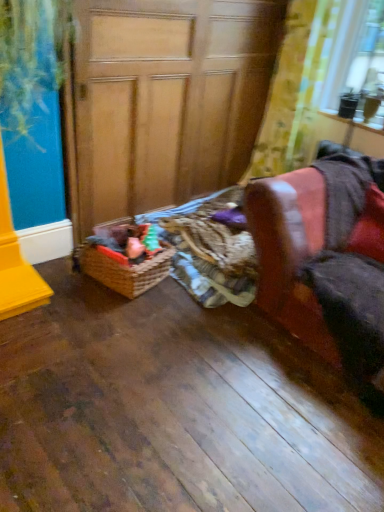
Question: Is the surface of yellow floral fabric at upper right in direct contact with woven brown basket at lower center?

Choices:
 (A) no
 (B) yes

Answer: (A)

Question: Is woven brown basket at lower center inside yellow floral fabric at upper right?

Choices:
 (A) yes
 (B) no

Answer: (B)

Question: Is the depth of yellow floral fabric at upper right greater than that of woven brown basket at lower center?

Choices:
 (A) no
 (B) yes

Answer: (B)

Question: From the image's perspective, is yellow floral fabric at upper right on woven brown basket at lower center?

Choices:
 (A) no
 (B) yes

Answer: (B)

Question: Is yellow floral fabric at upper right to the right of woven brown basket at lower center from the viewer's perspective?

Choices:
 (A) yes
 (B) no

Answer: (A)

Question: Is point (135, 276) closer or farther from the camera than point (208, 135)?

Choices:
 (A) closer
 (B) farther

Answer: (A)

Question: Do you think woven brown basket at lower center is within wooden at left, or outside of it?

Choices:
 (A) inside
 (B) outside

Answer: (B)

Question: Is woven brown basket at lower center taller or shorter than wooden at left?

Choices:
 (A) tall
 (B) short

Answer: (B)

Question: From a real-world perspective, is woven brown basket at lower center above or below wooden at left?

Choices:
 (A) below
 (B) above

Answer: (A)

Question: Would you say leather armchair at right is inside or outside yellow floral fabric at upper right?

Choices:
 (A) inside
 (B) outside

Answer: (B)

Question: Considering the positions of point pyautogui.click(x=324, y=312) and point pyautogui.click(x=327, y=20), is point pyautogui.click(x=324, y=312) closer or farther from the camera than point pyautogui.click(x=327, y=20)?

Choices:
 (A) closer
 (B) farther

Answer: (A)

Question: From a real-world perspective, is leather armchair at right positioned above or below yellow floral fabric at upper right?

Choices:
 (A) above
 (B) below

Answer: (B)

Question: Looking at the image, does leather armchair at right seem bigger or smaller compared to yellow floral fabric at upper right?

Choices:
 (A) big
 (B) small

Answer: (A)

Question: From a real-world perspective, relative to yellow floral fabric at upper right, is woven brown basket at lower center vertically above or below?

Choices:
 (A) above
 (B) below

Answer: (B)

Question: Visually, is woven brown basket at lower center positioned to the left or to the right of yellow floral fabric at upper right?

Choices:
 (A) right
 (B) left

Answer: (B)